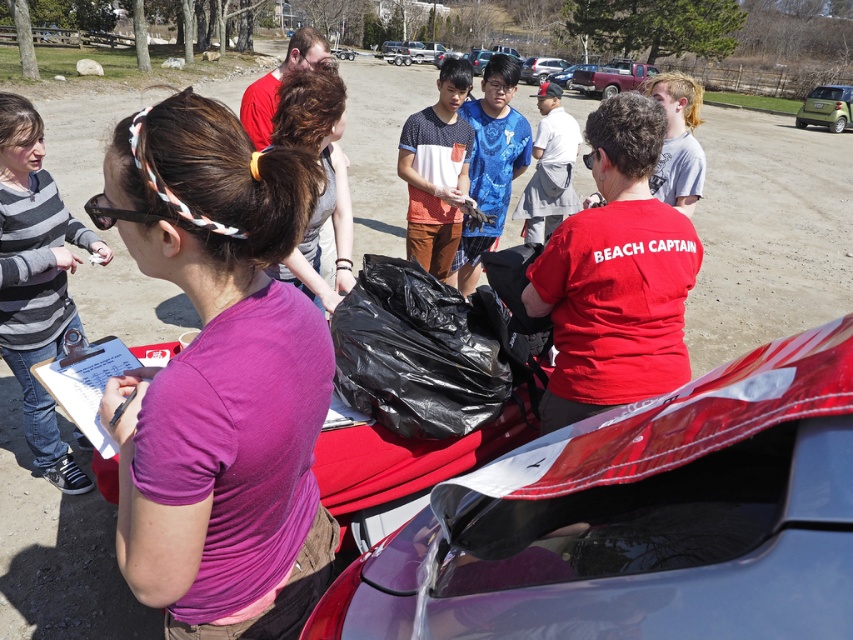
You are a participant in the beach cleanup and need to place a small flag between the glossy plastic car at center and the green matte car at upper right. Based on their heights, which car should the flag be placed closer to?

The glossy plastic car at center is shorter than the green matte car at upper right. To place the flag between them based on height, it should be closer to the glossy plastic car at center since it is shorter.

You are a participant in the beach cleanup event. You need to place a 2.5 meter long banner between the glossy plastic car at center and the green matte car at upper right. Is there enough space to place the banner without it overlapping either car?

The glossy plastic car at center is 30.32 meters away from the green matte car at upper right. Since the banner is only 2.5 meters long, there is more than enough space to place it between them without overlapping either car.